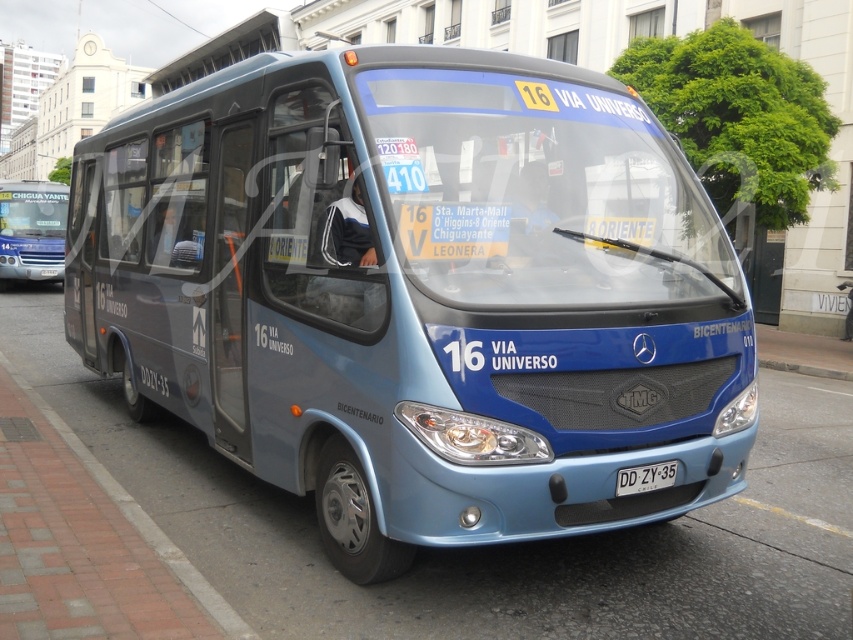
Does brick pavement at lower left appear over matte blue bus at left?

No.

Is point (845, 426) closer to viewer compared to point (16, 221)?

Yes.

Is point (813, 582) closer to camera compared to point (0, 236)?

Yes.

The height and width of the screenshot is (640, 853). I want to click on brick pavement at lower left, so click(x=488, y=547).

Does matte blue bus at left have a lesser height compared to white plastic license plate at center?

In fact, matte blue bus at left may be taller than white plastic license plate at center.

Is point (3, 243) behind point (631, 468)?

Yes, it is.

Where is `matte blue bus at left`? matte blue bus at left is located at coordinates (32, 230).

From the picture: Does brick pavement at lower left have a larger size compared to dark blue fabric jacket at center?

Yes.

Who is more forward, (485, 577) or (357, 253)?

Positioned in front is point (357, 253).

The height and width of the screenshot is (640, 853). What are the coordinates of `brick pavement at lower left` in the screenshot? It's located at pos(488,547).